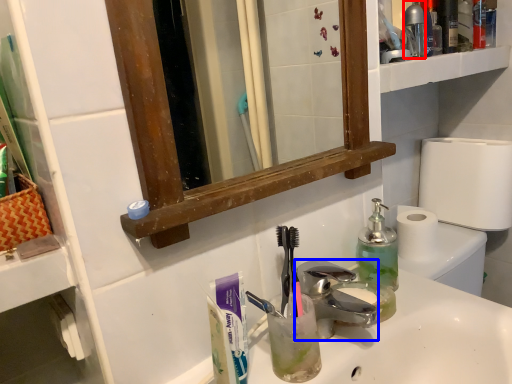
Question: Which object appears closest to the camera in this image, bottle (highlighted by a red box) or faucet (highlighted by a blue box)?

Choices:
 (A) bottle
 (B) faucet

Answer: (B)